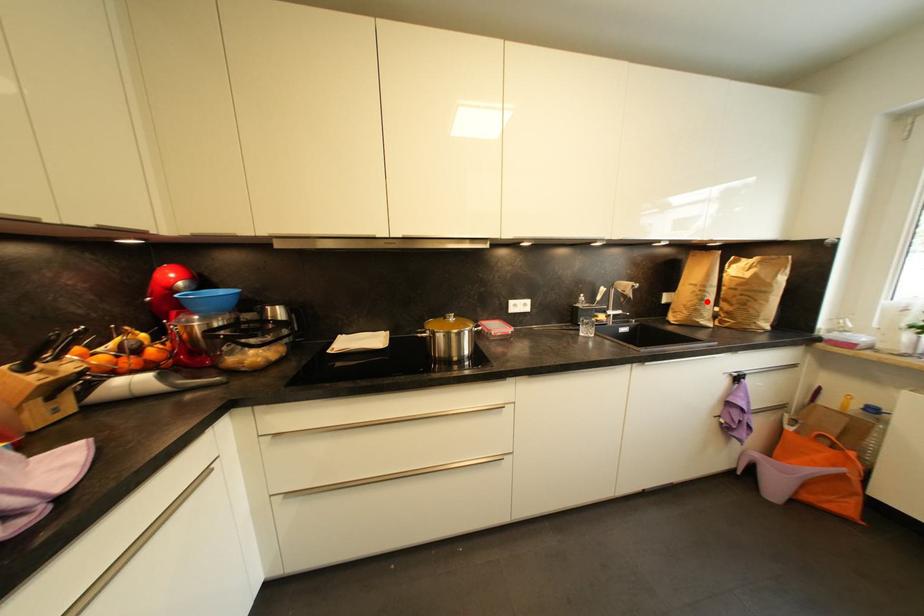
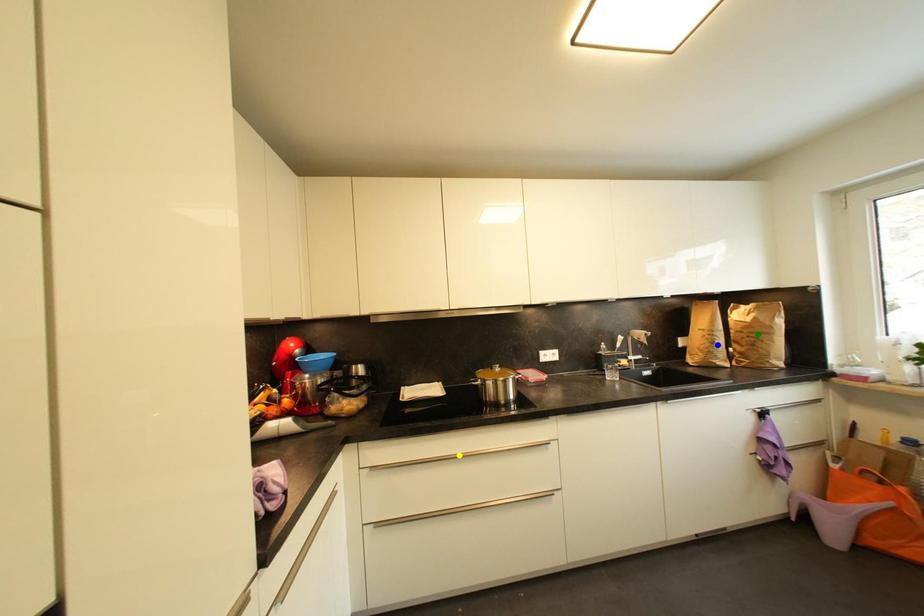
Question: I am providing you with two images of the same scene from different viewpoints. A red point is marked on the first image. You are given multiple points on the second image. In image 2, which mark is for the same physical point as the one in image 1?

Choices:
 (A) yellow point
 (B) green point
 (C) blue point

Answer: (C)